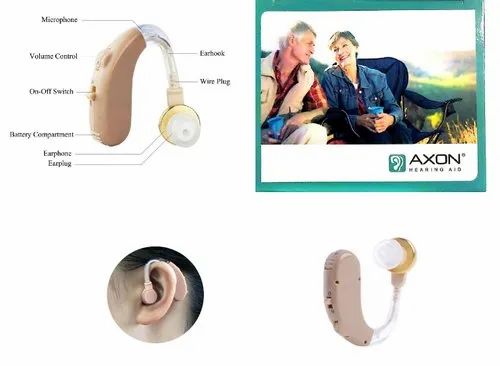
Locate an element on the screen. wire plug is located at coordinates 148,277, 375,336, 171,76.